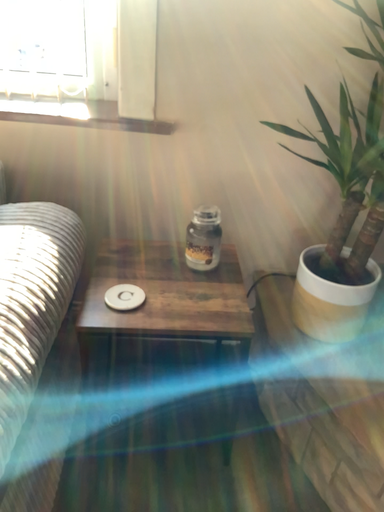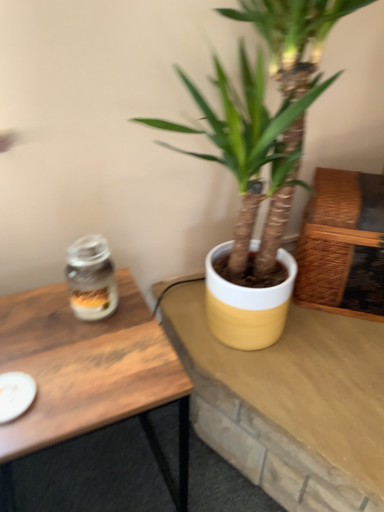
Question: Which way did the camera rotate in the video?

Choices:
 (A) rotated right
 (B) rotated left

Answer: (A)